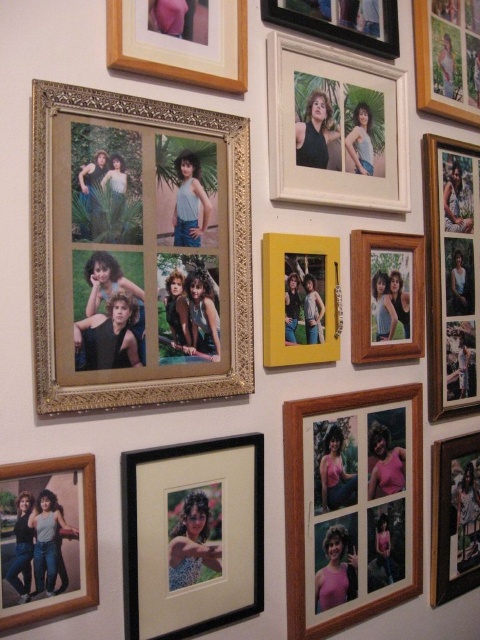
Question: Estimate the real-world distances between objects in this image. Which object is farther from the wooden photo frame at right?

Choices:
 (A) wooden photo frame at lower center
 (B) wooden photo frame at upper center
 (C) gold metallic frame at upper left

Answer: (C)

Question: Estimate the real-world distances between objects in this image. Which object is closer to the matte wood photo frame at lower left?

Choices:
 (A) wooden photo frame at right
 (B) wooden photo frame at center-right
 (C) wooden photo frame at upper center
 (D) black matte photo frame at lower center

Answer: (D)

Question: Which of the following is the farthest from the observer?

Choices:
 (A) matte wood photo frame at lower left
 (B) wooden photo frame at upper center

Answer: (B)

Question: Does matte wood photo frame at lower left have a smaller size compared to wooden photo frame at upper right?

Choices:
 (A) no
 (B) yes

Answer: (B)

Question: Is white wood photo frame at upper center smaller than wooden photo frame at upper center?

Choices:
 (A) no
 (B) yes

Answer: (A)

Question: Considering the relative positions of black matte photo frame at lower center and wooden photo frame at right in the image provided, where is black matte photo frame at lower center located with respect to wooden photo frame at right?

Choices:
 (A) left
 (B) right

Answer: (A)